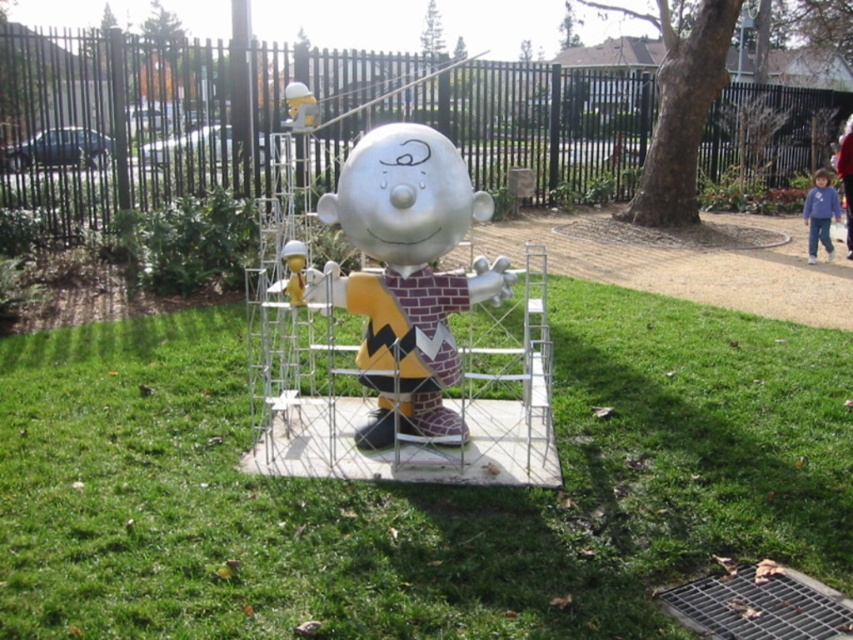
Consider the image. Between green grass at center and metallic silver statue at center, which one has more height?

Standing taller between the two is metallic silver statue at center.

Measure the distance between point (514,531) and camera.

3.22 meters

Which is in front, point (143, 355) or point (488, 276)?

Point (488, 276) is in front.

At what (x,y) coordinates should I click in order to perform the action: click on green grass at center. Please return your answer as a coordinate pair (x, y). Looking at the image, I should click on (416, 486).